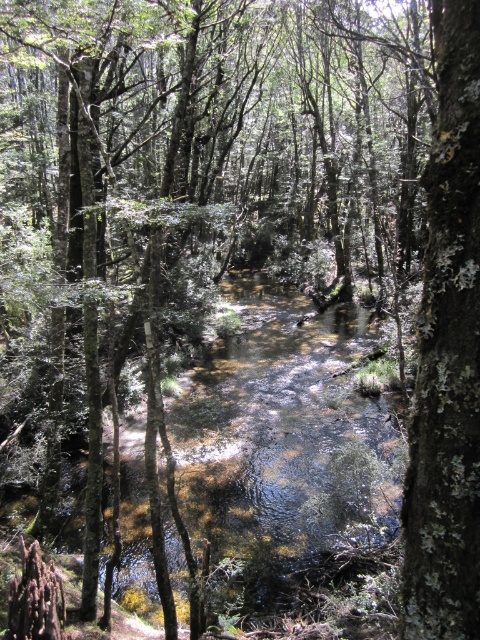
You are standing at the edge of the forest and want to cross the stream using the shallowest part. According to the image, where is the clear water at center located?

The clear water at center is located at point (290, 461), which indicates its position in the scene. To cross the stream, you should head towards that coordinate for the shallowest part.